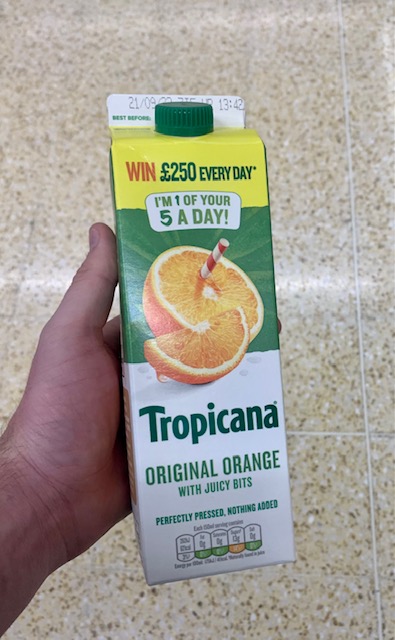
Find the location of a particular element. This screenshot has height=640, width=395. speckled tile floor is located at coordinates (311, 310).